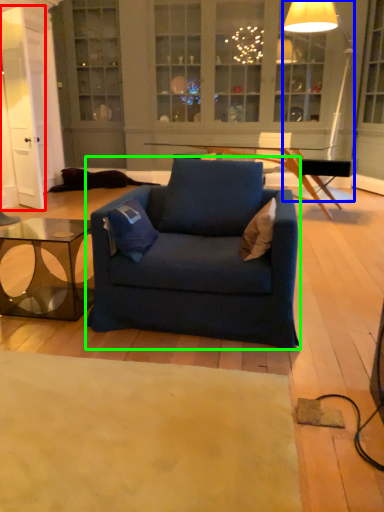
Question: Which object is positioned farthest from glass door (highlighted by a red box)? Select from lamp (highlighted by a blue box) and chair (highlighted by a green box).

Choices:
 (A) lamp
 (B) chair

Answer: (A)